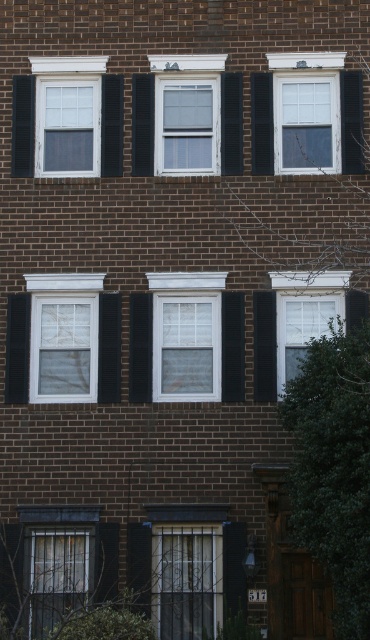
Which is more to the left, white matte window at center left or clear glass window at upper center?

Positioned to the left is white matte window at center left.

From the picture: Who is taller, white matte window at center left or clear glass window at upper center?

white matte window at center left

Locate an element on the screen. Image resolution: width=370 pixels, height=640 pixels. white matte window at center left is located at coordinates (64, 337).

Locate an element on the screen. The image size is (370, 640). white matte window at upper center is located at coordinates (79, 122).

Does point (88, 131) come closer to viewer compared to point (274, 113)?

That is False.

Where is `white matte window at upper center`? The width and height of the screenshot is (370, 640). white matte window at upper center is located at coordinates (79, 122).

Which is below, white matte window at upper center or matte glass window at lower left?

Positioned lower is matte glass window at lower left.

Is point (62, 132) closer to viewer compared to point (58, 604)?

No, (62, 132) is further to viewer.

Who is more distant from viewer, (116, 173) or (78, 557)?

Positioned behind is point (116, 173).

The height and width of the screenshot is (640, 370). In order to click on white matte window at upper center in this screenshot , I will do `click(79, 122)`.